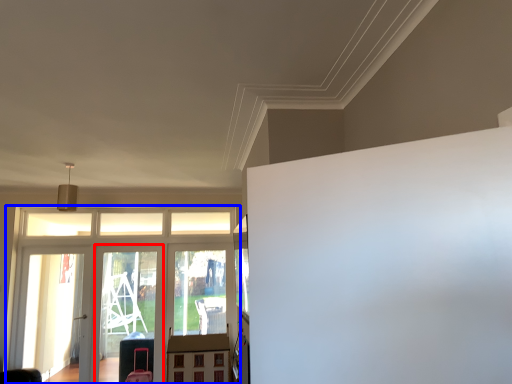
Question: Among these objects, which one is nearest to the camera, screen door (highlighted by a red box) or elevator (highlighted by a blue box)?

Choices:
 (A) screen door
 (B) elevator

Answer: (B)